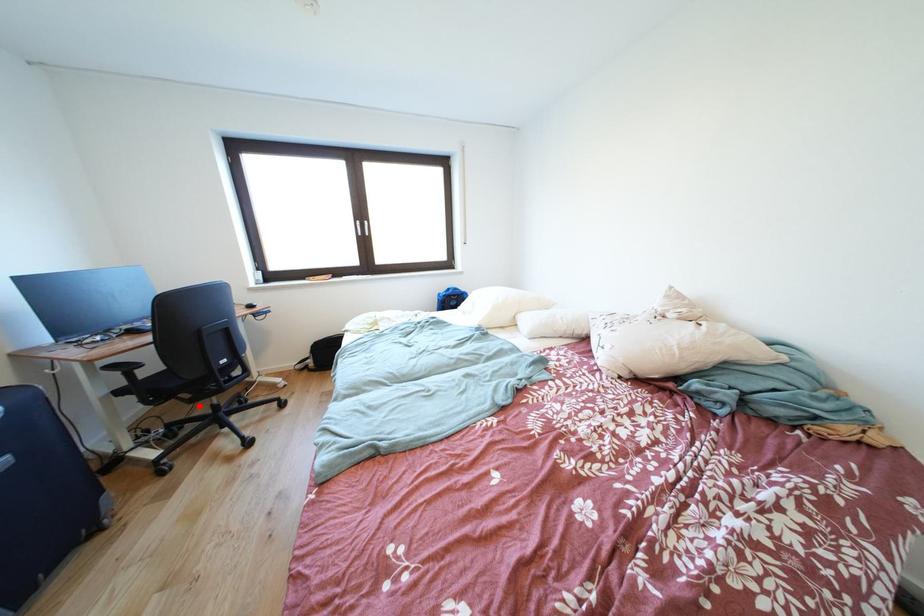
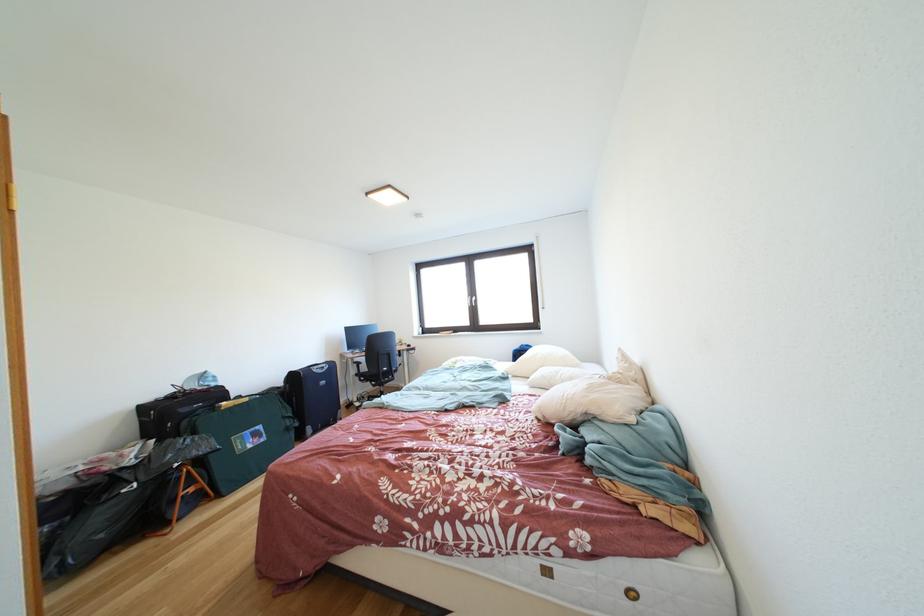
In the second image, find the point that corresponds to the highlighted location in the first image.

(383, 391)